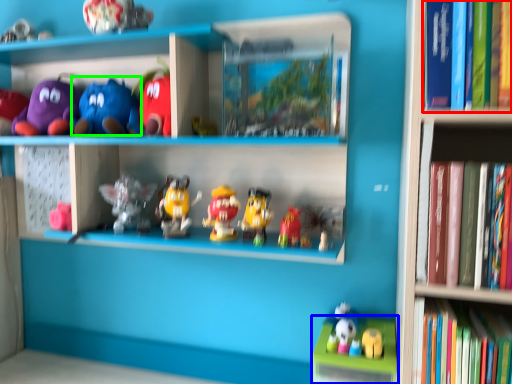
Question: Which object is the farthest from book (highlighted by a red box)? Choose among these: cabinet (highlighted by a blue box) or toy (highlighted by a green box).

Choices:
 (A) cabinet
 (B) toy

Answer: (B)